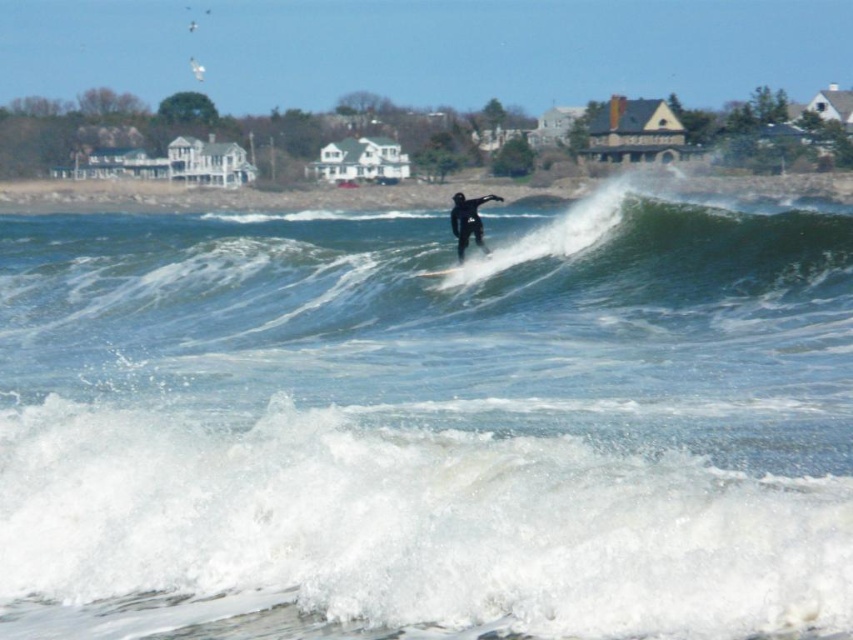
Is point (328, 490) positioned behind point (460, 228)?

No, (328, 490) is closer to viewer.

At what (x,y) coordinates should I click in order to perform the action: click on clear blue water at wave center. Please return your answer as a coordinate pair (x, y). The image size is (853, 640). Looking at the image, I should click on (428, 424).

Find the location of a particular element. clear blue water at wave center is located at coordinates (428, 424).

Which is behind, point (96, 460) or point (439, 269)?

The point (439, 269) is more distant.

At what (x,y) coordinates should I click in order to perform the action: click on clear blue water at wave center. Please return your answer as a coordinate pair (x, y). Looking at the image, I should click on (428, 424).

Find the location of `clear blue water at wave center`. clear blue water at wave center is located at coordinates (428, 424).

Can you confirm if black matte wetsuit at center is bigger than smooth black surfboard at center?

Indeed, black matte wetsuit at center has a larger size compared to smooth black surfboard at center.

Is point (467, 212) positioned after point (428, 276)?

That is True.

Locate an element on the screen. The image size is (853, 640). black matte wetsuit at center is located at coordinates (468, 221).